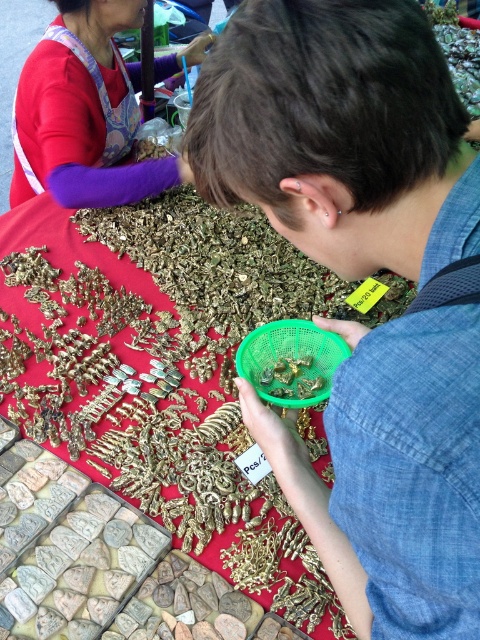
You are a customer at the market and want to pick up the green plastic basket at center. However, there is a person in the way wearing the matte red shirt at upper left. Can you reach the basket without moving the person?

The green plastic basket at center is in front of the matte red shirt at upper left, so you can reach it without moving the person because the basket is already positioned in front of them.

You are a customer at the market and want to know if the green plastic basket at center can hold all the gold metallic jewelry at center. Based on their sizes, can it fit?

The green plastic basket at center is smaller than the gold metallic jewelry at center, so it cannot hold all of them.

You are a customer at the market and want to pick up an item from the gold metallic jewelry at center. You are currently holding the green plastic basket at center. Can you reach the jewelry without moving the basket?

The green plastic basket at center and gold metallic jewelry at center are 44.67 centimeters apart. Since the distance is more than arm length, you would need to move the basket or take it to reach the jewelry.